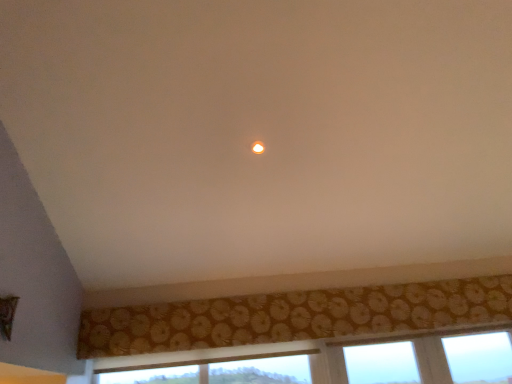
Question: Could you tell me if matte yellow light at center is facing gold textured curtain at lower center?

Choices:
 (A) no
 (B) yes

Answer: (A)

Question: Does matte yellow light at center have a greater width compared to gold textured curtain at lower center?

Choices:
 (A) no
 (B) yes

Answer: (B)

Question: Is matte yellow light at center far away from gold textured curtain at lower center?

Choices:
 (A) no
 (B) yes

Answer: (B)

Question: Is matte yellow light at center next to gold textured curtain at lower center and touching it?

Choices:
 (A) yes
 (B) no

Answer: (B)

Question: Is matte yellow light at center bigger than gold textured curtain at lower center?

Choices:
 (A) no
 (B) yes

Answer: (A)

Question: Is matte yellow light at center taller than gold textured curtain at lower center?

Choices:
 (A) no
 (B) yes

Answer: (A)

Question: Does gold textured curtain at lower center have a larger size compared to matte yellow light at center?

Choices:
 (A) no
 (B) yes

Answer: (B)

Question: From the image's perspective, would you say gold textured curtain at lower center is positioned over matte yellow light at center?

Choices:
 (A) no
 (B) yes

Answer: (A)

Question: Can you confirm if gold textured curtain at lower center is positioned to the right of matte yellow light at center?

Choices:
 (A) no
 (B) yes

Answer: (B)

Question: Is gold textured curtain at lower center to the left of matte yellow light at center from the viewer's perspective?

Choices:
 (A) yes
 (B) no

Answer: (B)

Question: Is gold textured curtain at lower center located outside matte yellow light at center?

Choices:
 (A) yes
 (B) no

Answer: (A)

Question: From a real-world perspective, does gold textured curtain at lower center sit lower than matte yellow light at center?

Choices:
 (A) yes
 (B) no

Answer: (A)

Question: Considering the positions of gold textured curtain at lower center and matte yellow light at center in the image, is gold textured curtain at lower center bigger or smaller than matte yellow light at center?

Choices:
 (A) big
 (B) small

Answer: (A)